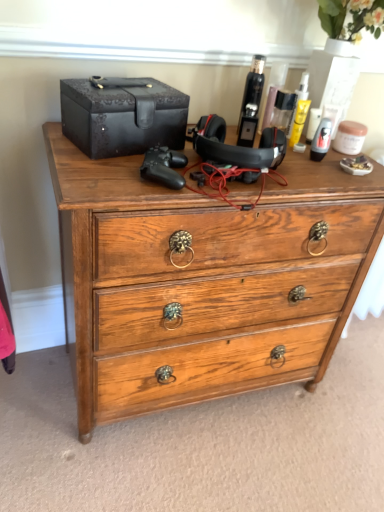
Question: Can we say shiny black hair spray at upper center, which ranks as the 2th toiletry in right-to-left order, lies outside shiny black bottle at upper right, the 2th toiletry positioned from the left?

Choices:
 (A) no
 (B) yes

Answer: (B)

Question: Is the depth of shiny black hair spray at upper center, the first toiletry from the left, less than that of shiny black bottle at upper right, the 2th toiletry positioned from the left?

Choices:
 (A) yes
 (B) no

Answer: (A)

Question: From a real-world perspective, is shiny black hair spray at upper center, the first toiletry from the left, under shiny black bottle at upper right, the 2th toiletry positioned from the left?

Choices:
 (A) no
 (B) yes

Answer: (B)

Question: Considering the relative sizes of shiny black hair spray at upper center, which ranks as the 2th toiletry in right-to-left order, and shiny black bottle at upper right, the 2th toiletry positioned from the left, in the image provided, is shiny black hair spray at upper center, which ranks as the 2th toiletry in right-to-left order, bigger than shiny black bottle at upper right, the 2th toiletry positioned from the left,?

Choices:
 (A) yes
 (B) no

Answer: (A)

Question: Is shiny black hair spray at upper center, the first toiletry from the left, to the right of shiny black bottle at upper right, which is the 1th toiletry from right to left, from the viewer's perspective?

Choices:
 (A) no
 (B) yes

Answer: (A)

Question: In the image, is shiny black hair spray at upper center, which ranks as the 2th toiletry in right-to-left order, positioned in front of or behind wooden chest of drawers at center?

Choices:
 (A) behind
 (B) front

Answer: (A)

Question: Based on their positions, is shiny black hair spray at upper center, the first toiletry from the left, located to the left or right of wooden chest of drawers at center?

Choices:
 (A) left
 (B) right

Answer: (B)

Question: In terms of size, does shiny black hair spray at upper center, which ranks as the 2th toiletry in right-to-left order, appear bigger or smaller than wooden chest of drawers at center?

Choices:
 (A) big
 (B) small

Answer: (B)

Question: From a real-world perspective, relative to wooden chest of drawers at center, is shiny black hair spray at upper center, the first toiletry from the left, vertically above or below?

Choices:
 (A) below
 (B) above

Answer: (B)

Question: From their relative heights in the image, would you say black leather box at upper left is taller or shorter than wooden chest of drawers at center?

Choices:
 (A) tall
 (B) short

Answer: (B)

Question: Relative to wooden chest of drawers at center, is black leather box at upper left in front or behind?

Choices:
 (A) front
 (B) behind

Answer: (B)

Question: Do you think black leather box at upper left is within wooden chest of drawers at center, or outside of it?

Choices:
 (A) outside
 (B) inside

Answer: (A)

Question: Is black leather box at upper left wider or thinner than wooden chest of drawers at center?

Choices:
 (A) thin
 (B) wide

Answer: (A)

Question: Is wooden chest of drawers at center bigger or smaller than black leather box at upper left?

Choices:
 (A) big
 (B) small

Answer: (A)

Question: Visually, is wooden chest of drawers at center positioned to the left or to the right of black leather box at upper left?

Choices:
 (A) right
 (B) left

Answer: (A)